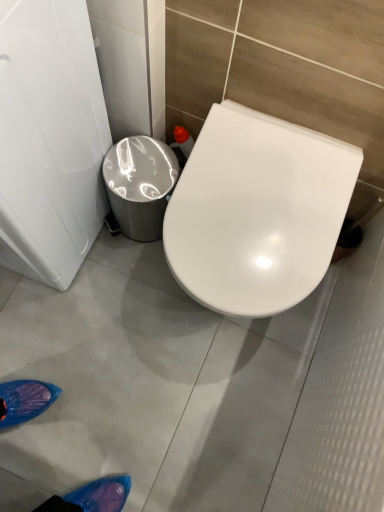
Question: Is shiny metallic trash can at center left positioned in front of white glossy toilet seat at center?

Choices:
 (A) no
 (B) yes

Answer: (A)

Question: Is white glossy toilet seat at center surrounded by shiny metallic trash can at center left?

Choices:
 (A) yes
 (B) no

Answer: (B)

Question: Is shiny metallic trash can at center left outside of white glossy toilet seat at center?

Choices:
 (A) no
 (B) yes

Answer: (B)

Question: Can you confirm if shiny metallic trash can at center left is positioned to the right of white glossy toilet seat at center?

Choices:
 (A) yes
 (B) no

Answer: (B)

Question: Is shiny metallic trash can at center left with white glossy toilet seat at center?

Choices:
 (A) yes
 (B) no

Answer: (B)

Question: Is shiny metallic trash can at center left facing away from white glossy toilet seat at center?

Choices:
 (A) yes
 (B) no

Answer: (B)

Question: Does white glossy toilet seat at center have a lesser height compared to shiny metallic trash can at center left?

Choices:
 (A) yes
 (B) no

Answer: (B)

Question: From the image's perspective, does white glossy toilet seat at center appear higher than shiny metallic trash can at center left?

Choices:
 (A) no
 (B) yes

Answer: (A)

Question: Considering the relative positions of white glossy toilet seat at center and shiny metallic trash can at center left in the image provided, is white glossy toilet seat at center to the right of shiny metallic trash can at center left from the viewer's perspective?

Choices:
 (A) yes
 (B) no

Answer: (A)

Question: Is white glossy toilet seat at center oriented towards shiny metallic trash can at center left?

Choices:
 (A) no
 (B) yes

Answer: (A)

Question: Is there a large distance between white glossy toilet seat at center and shiny metallic trash can at center left?

Choices:
 (A) yes
 (B) no

Answer: (B)

Question: Can you confirm if white glossy toilet seat at center is wider than shiny metallic trash can at center left?

Choices:
 (A) no
 (B) yes

Answer: (B)

Question: From a real-world perspective, relative to white glossy toilet seat at center, is shiny metallic trash can at center left vertically above or below?

Choices:
 (A) below
 (B) above

Answer: (A)